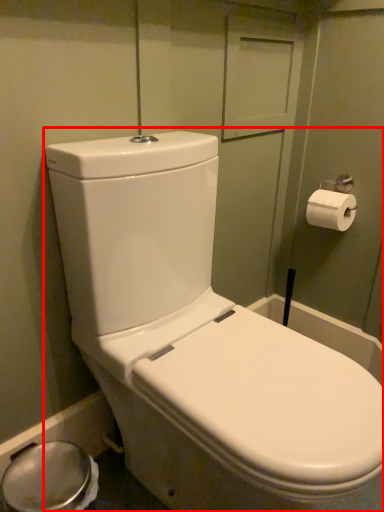
Question: Where is toilet (annotated by the red box) located in relation to toilet paper in the image?

Choices:
 (A) right
 (B) left

Answer: (B)